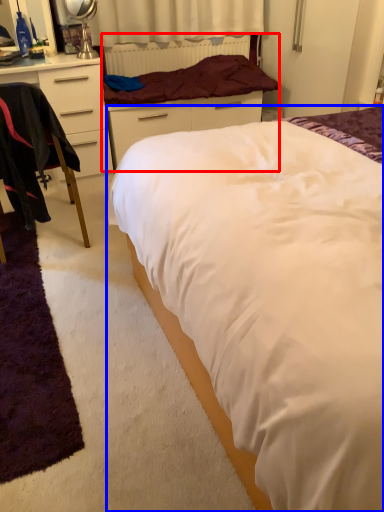
Question: Which point is further to the camera, bed frame (highlighted by a red box) or bed (highlighted by a blue box)?

Choices:
 (A) bed frame
 (B) bed

Answer: (A)